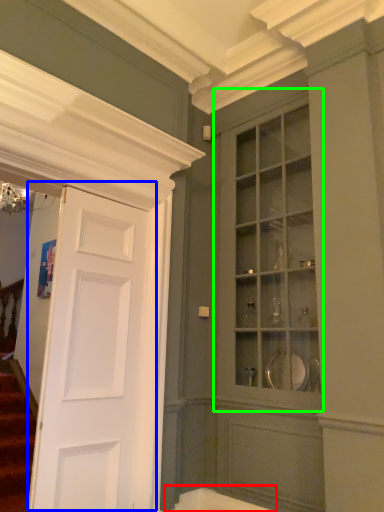
Question: Which object is positioned closest to bath (highlighted by a red box)? Select from door (highlighted by a blue box) and cabinetry (highlighted by a green box).

Choices:
 (A) door
 (B) cabinetry

Answer: (A)